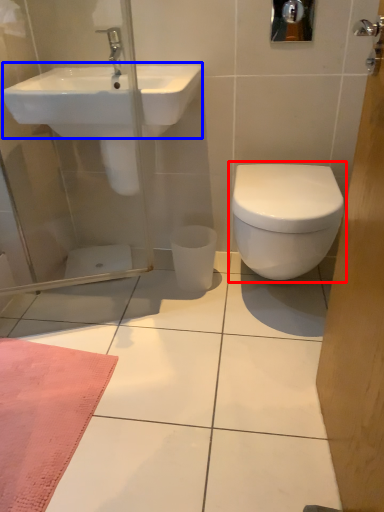
Question: Which point is further to the camera, toilet (highlighted by a red box) or sink (highlighted by a blue box)?

Choices:
 (A) toilet
 (B) sink

Answer: (A)